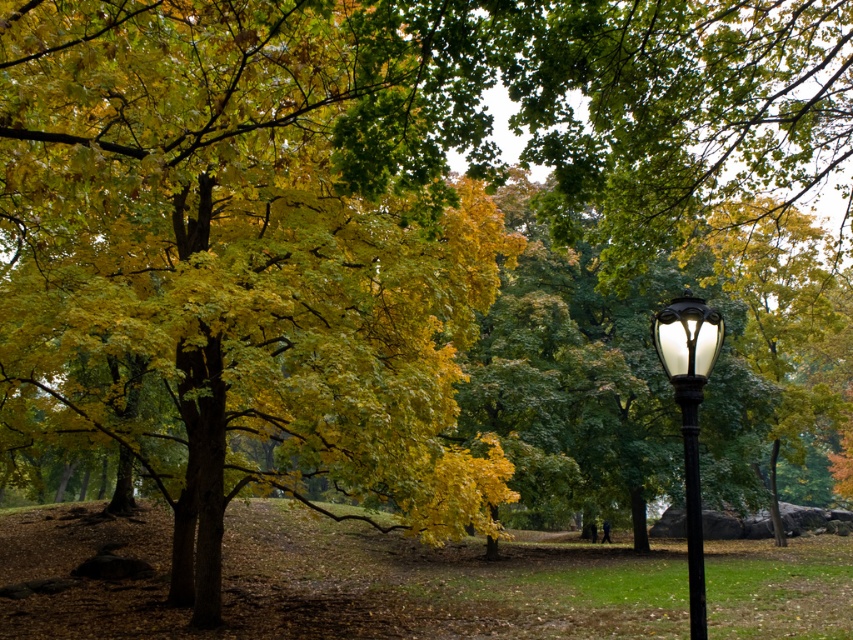
Is black metal lamp post at right shorter than black polished metal pole at right?

No.

Does point (654, 330) come farther from viewer compared to point (691, 522)?

That is True.

This screenshot has height=640, width=853. I want to click on black metal lamp post at right, so click(x=689, y=417).